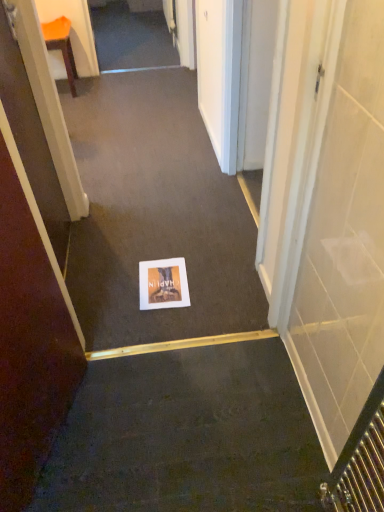
Identify the location of empty space that is ontop of white paper at center. (144, 199).